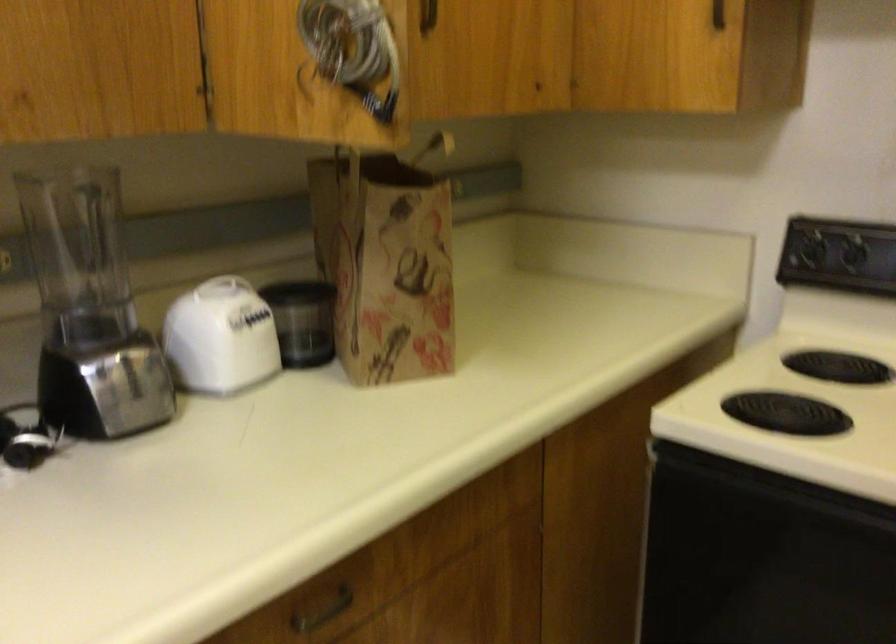
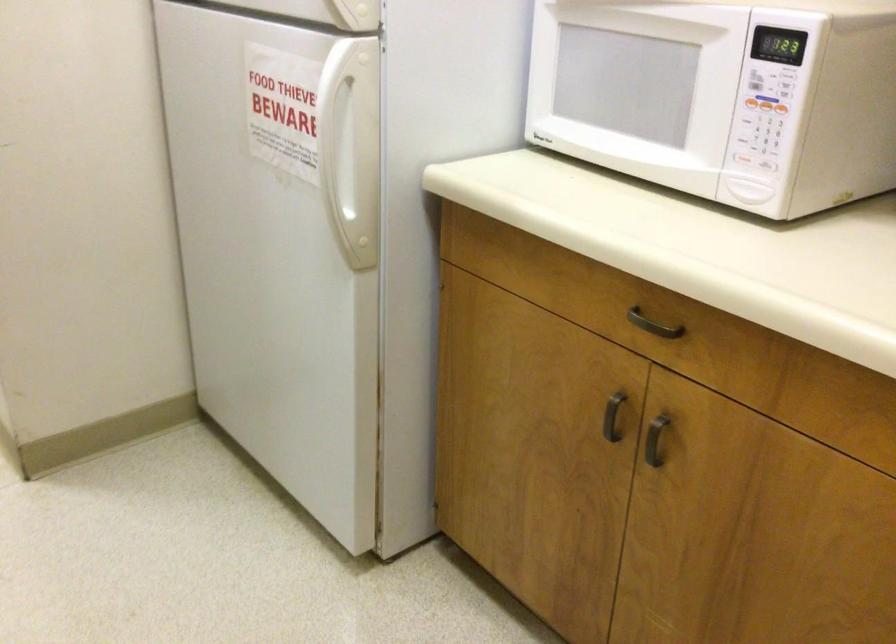
The images are taken continuously from a first-person perspective. In which direction is your viewpoint rotating?

The rotation direction of the camera is left-down.